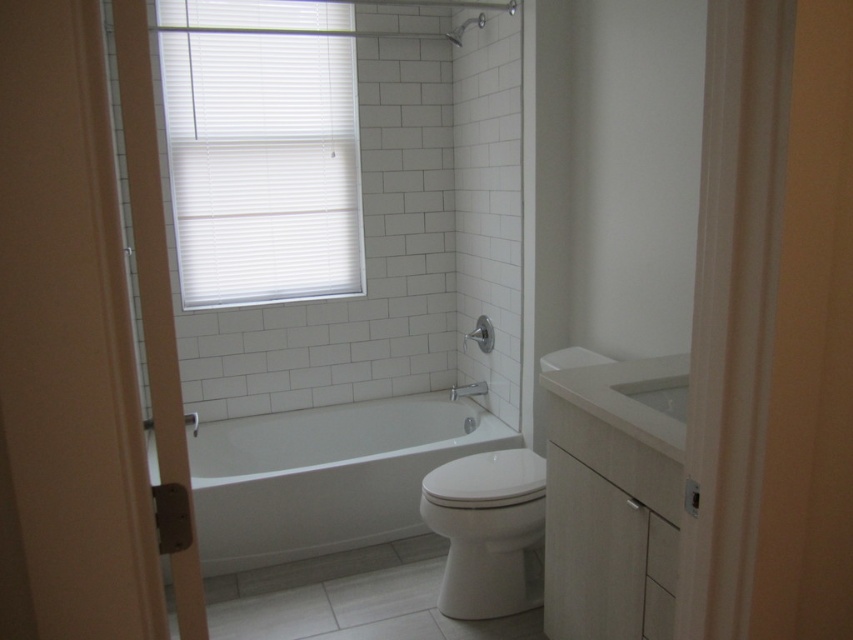
You are standing in the doorway of the bathroom. There is a point marked at coordinates (x=260, y=148). What object in the bathroom does this point correspond to?

The point at coordinates (x=260, y=148) corresponds to the white blinds at upper left.

You are standing in the doorway of the bathroom and need to reach the white glossy toilet at center. Which direction should you move relative to the matte white shower at center?

Since the white glossy toilet at center is located below the matte white shower at center, you should move downward or towards the lower part of the bathroom to reach the toilet relative to the shower.

You are standing in the doorway of the bathroom and want to wash your hands. Which object should you approach first, the white glossy bathtub at center or the white glossy sink at center?

You should approach the white glossy sink at center first because it is behind the white glossy bathtub at center, making it closer to you from the doorway.